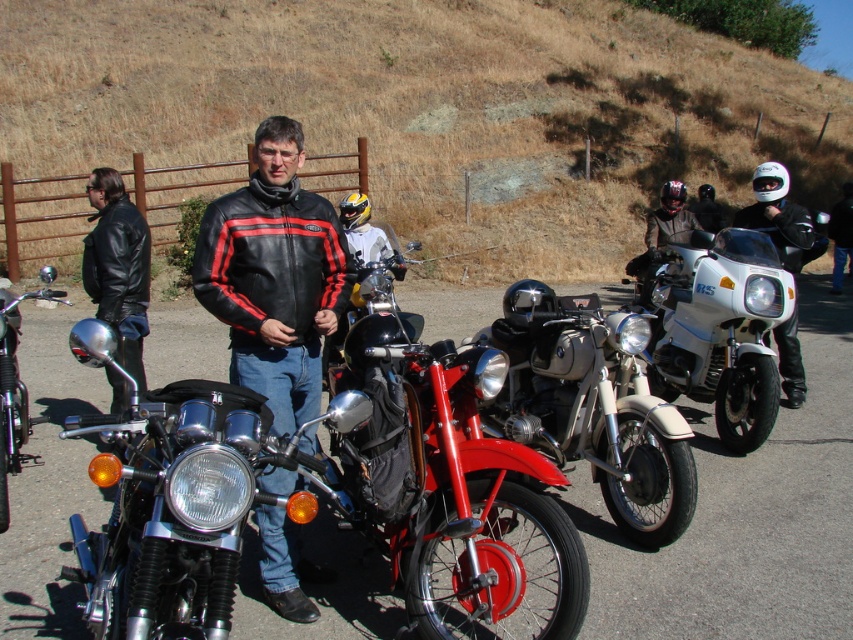
You are a photographer trying to capture a clear shot of the shiny chrome handlebars at left without the black leather jacket at center blocking it. What should you do?

The black leather jacket at center is positioned over the shiny chrome handlebars at left, so you should move your camera position to the right to avoid the jacket blocking the handlebars.

You are standing at the point marked as point (x=274, y=275) in the image. What object is located exactly at this point?

The point (x=274, y=275) corresponds to the black leather jacket at center.